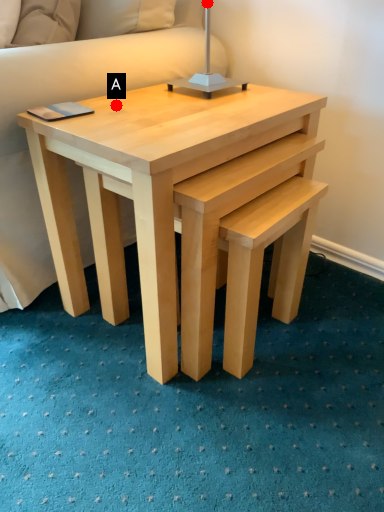
Question: Two points are circled on the image, labeled by A and B beside each circle. Among these points, which one is farthest from the camera?

Choices:
 (A) A is further
 (B) B is further

Answer: (B)